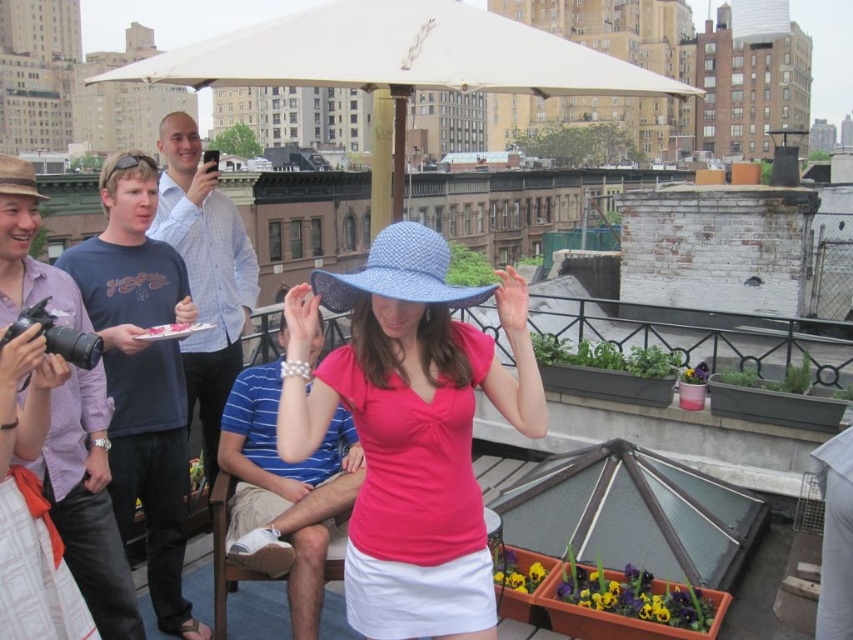
How far apart are white fabric umbrella at upper center and white fabric canopy at upper center?

white fabric umbrella at upper center and white fabric canopy at upper center are 29.21 inches apart.

Does white fabric umbrella at upper center have a greater width compared to white fabric canopy at upper center?

Yes.

This screenshot has height=640, width=853. What do you see at coordinates (399, 60) in the screenshot?
I see `white fabric umbrella at upper center` at bounding box center [399, 60].

The width and height of the screenshot is (853, 640). What are the coordinates of `white fabric umbrella at upper center` in the screenshot? It's located at (399, 60).

From the picture: Who is higher up, dark blue t-shirt at center or blue denim jeans at left?

dark blue t-shirt at center is above.

Is dark blue t-shirt at center smaller than blue denim jeans at left?

No.

Does point (161, 500) come farther from viewer compared to point (9, 308)?

Yes, it is behind point (9, 308).

Find the location of a particular element. This screenshot has width=853, height=640. dark blue t-shirt at center is located at coordinates (141, 374).

Can you confirm if matte blue fabric hat at center is thinner than blue denim jeans at left?

No.

Image resolution: width=853 pixels, height=640 pixels. Find the location of `matte blue fabric hat at center`. matte blue fabric hat at center is located at coordinates (410, 416).